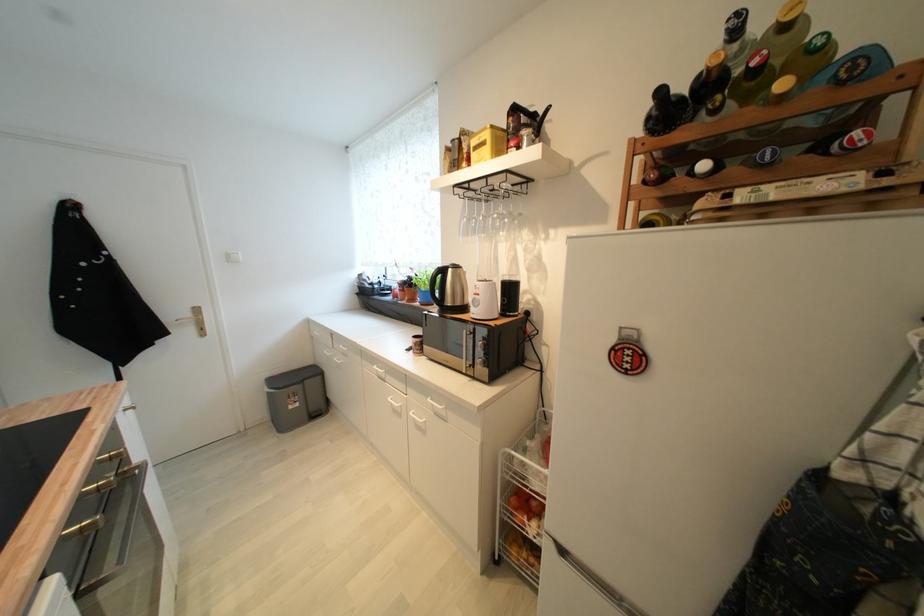
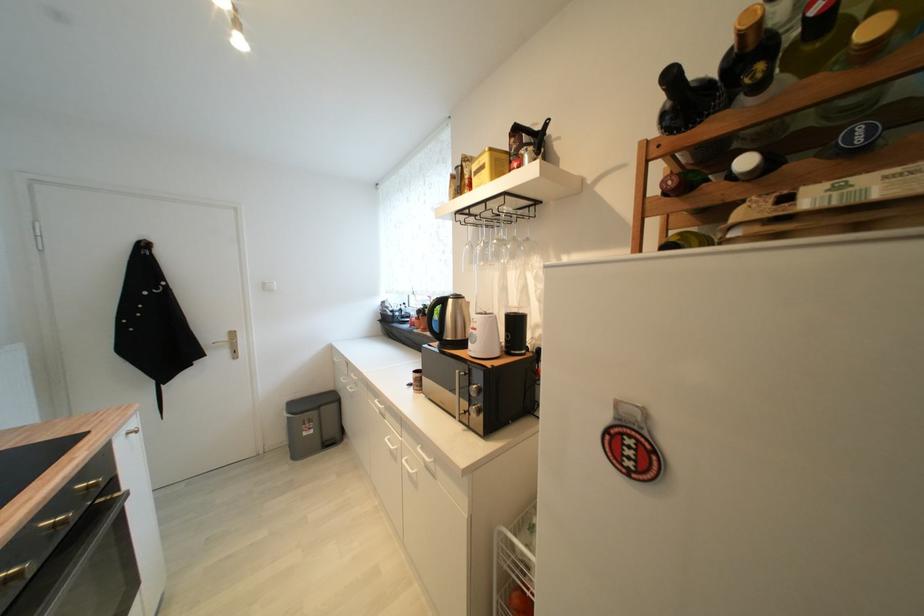
Where in the second image is the point corresponding to point 504,216 from the first image?

(504, 241)